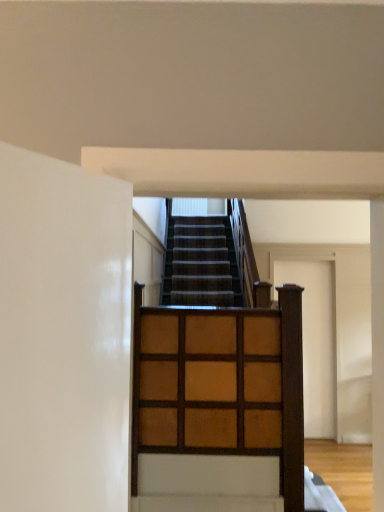
Question: From the image's perspective, is wooden door at center on wooden grid at center?

Choices:
 (A) yes
 (B) no

Answer: (B)

Question: From a real-world perspective, does wooden door at center sit lower than wooden grid at center?

Choices:
 (A) yes
 (B) no

Answer: (A)

Question: From the image's perspective, is wooden door at center located beneath wooden grid at center?

Choices:
 (A) no
 (B) yes

Answer: (B)

Question: Is wooden door at center oriented towards wooden grid at center?

Choices:
 (A) yes
 (B) no

Answer: (B)

Question: Can you confirm if wooden door at center is taller than wooden grid at center?

Choices:
 (A) no
 (B) yes

Answer: (B)

Question: Is wooden door at center not close to wooden grid at center?

Choices:
 (A) yes
 (B) no

Answer: (A)

Question: From a real-world perspective, is wooden grid at center positioned under wooden door at center based on gravity?

Choices:
 (A) yes
 (B) no

Answer: (B)

Question: Does wooden grid at center have a greater width compared to wooden door at center?

Choices:
 (A) yes
 (B) no

Answer: (A)

Question: Can you see wooden grid at center touching wooden door at center?

Choices:
 (A) no
 (B) yes

Answer: (A)

Question: Is wooden grid at center at the right side of wooden door at center?

Choices:
 (A) no
 (B) yes

Answer: (A)

Question: Does wooden grid at center have a greater height compared to wooden door at center?

Choices:
 (A) no
 (B) yes

Answer: (A)

Question: Is wooden grid at center positioned before wooden door at center?

Choices:
 (A) no
 (B) yes

Answer: (B)

Question: Considering their positions, is wooden door at center located in front of or behind wooden grid at center?

Choices:
 (A) front
 (B) behind

Answer: (B)